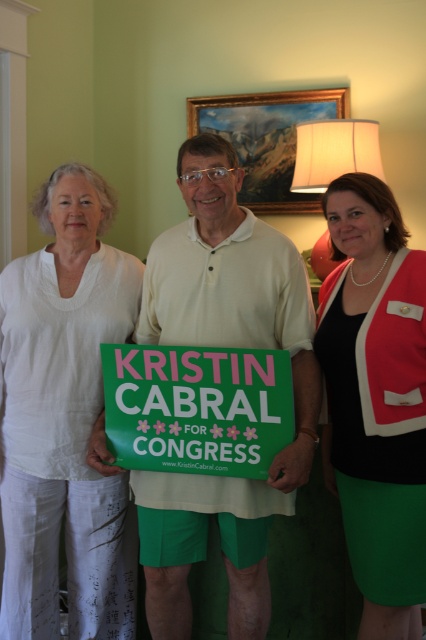
Question: Does green satin skirt at center have a lesser width compared to green matte sign at center?

Choices:
 (A) no
 (B) yes

Answer: (B)

Question: Estimate the real-world distances between objects in this image. Which object is farther from the white linen pants at left?

Choices:
 (A) green matte sign at center
 (B) white cotton polo shirt at center

Answer: (A)

Question: Does white cotton polo shirt at center have a lesser width compared to green satin skirt at center?

Choices:
 (A) yes
 (B) no

Answer: (B)

Question: Based on their relative distances, which object is nearer to the green matte sign at center?

Choices:
 (A) green satin skirt at center
 (B) white cotton polo shirt at center

Answer: (B)

Question: Among these objects, which one is nearest to the camera?

Choices:
 (A) green matte sign at center
 (B) white cotton polo shirt at center
 (C) green satin skirt at center
 (D) white linen pants at left

Answer: (B)

Question: Can you confirm if white cotton polo shirt at center is positioned to the left of green satin skirt at center?

Choices:
 (A) no
 (B) yes

Answer: (B)